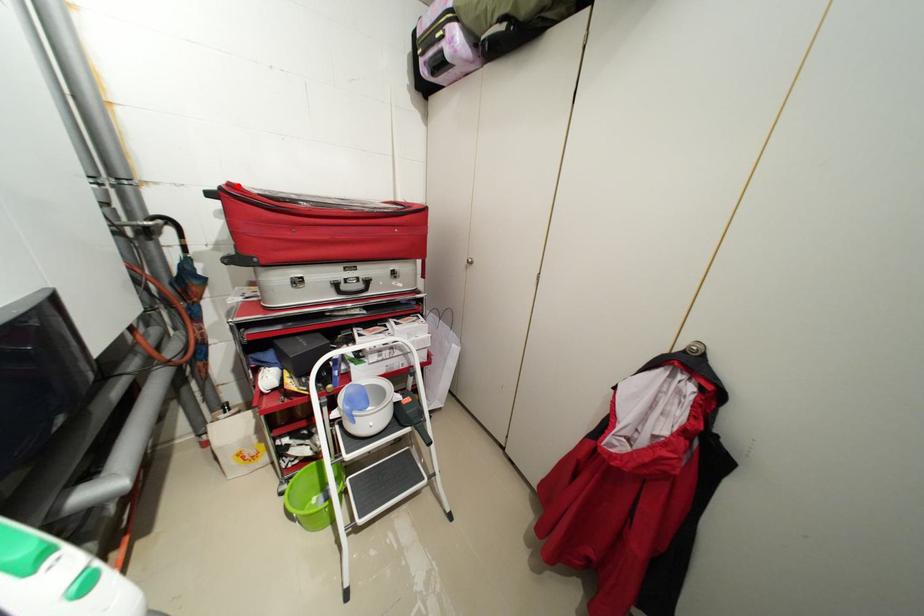
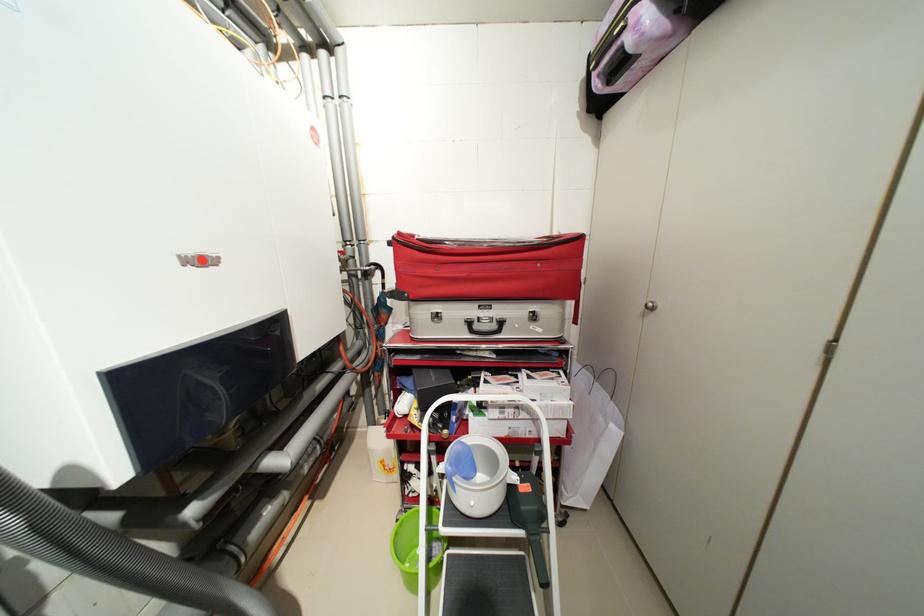
Find the pixel in the second image that matches the highlighted location in the first image.

(407, 235)